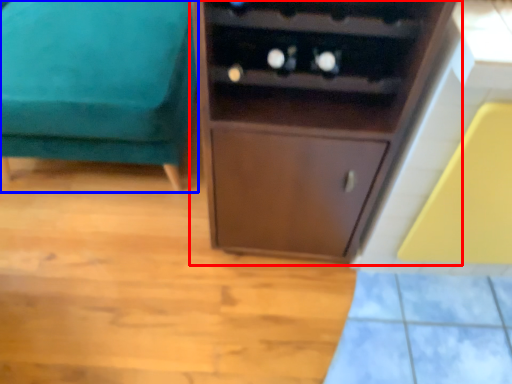
Question: Which point is further to the camera, cupboard (highlighted by a red box) or furniture (highlighted by a blue box)?

Choices:
 (A) cupboard
 (B) furniture

Answer: (B)